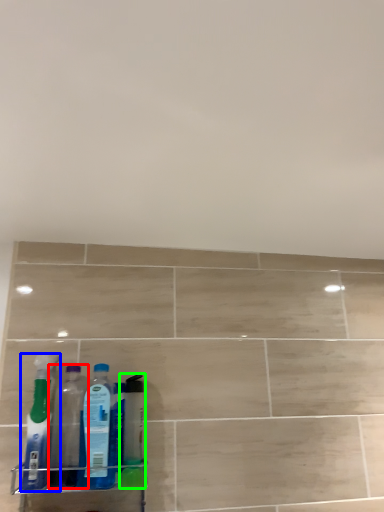
Question: Considering the real-world distances, which object is closest to bottle (highlighted by a red box)? bottle (highlighted by a blue box) or cleaning product (highlighted by a green box).

Choices:
 (A) bottle
 (B) cleaning product

Answer: (A)